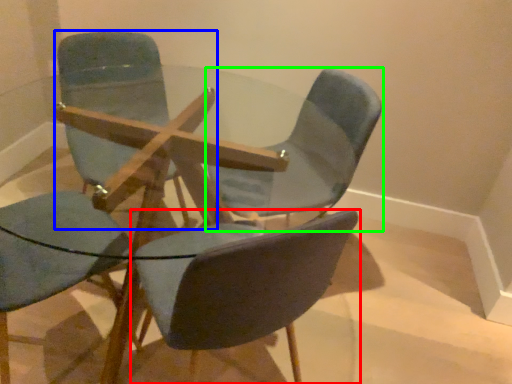
Question: Which is farther away from chair (highlighted by a red box)? chair (highlighted by a blue box) or chair (highlighted by a green box)?

Choices:
 (A) chair
 (B) chair

Answer: (A)